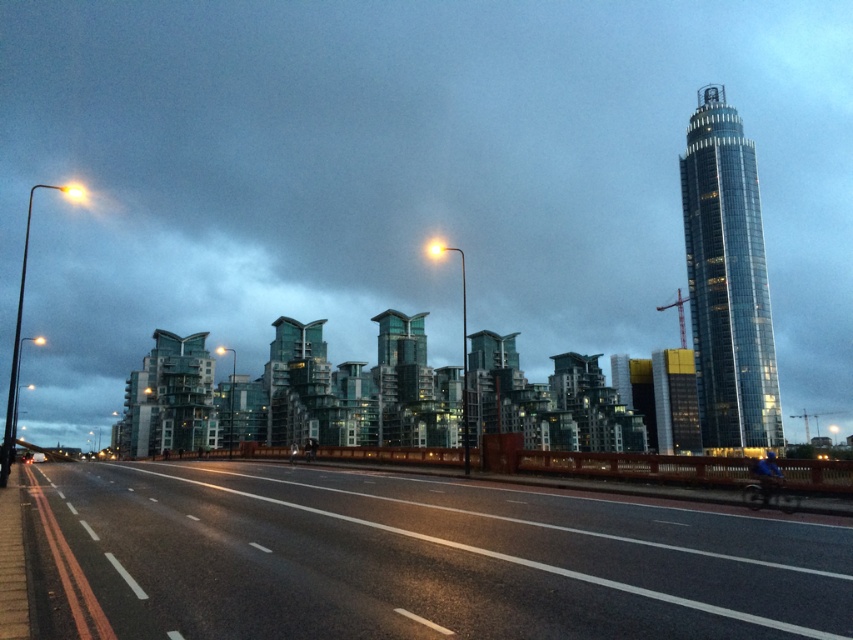
Question: Can you confirm if black asphalt highway at lower left is positioned above shiny glass tower at upper right?

Choices:
 (A) no
 (B) yes

Answer: (A)

Question: In this image, where is black asphalt highway at lower left located relative to shiny glass tower at upper right?

Choices:
 (A) above
 (B) below

Answer: (B)

Question: Is black asphalt highway at lower left thinner than shiny glass tower at upper right?

Choices:
 (A) no
 (B) yes

Answer: (A)

Question: Among these points, which one is farthest from the camera?

Choices:
 (A) (737, 161)
 (B) (102, 545)

Answer: (A)

Question: Which point is farther to the camera?

Choices:
 (A) black asphalt highway at lower left
 (B) shiny glass tower at upper right

Answer: (B)

Question: Which object appears closest to the camera in this image?

Choices:
 (A) shiny glass tower at upper right
 (B) black asphalt highway at lower left

Answer: (B)